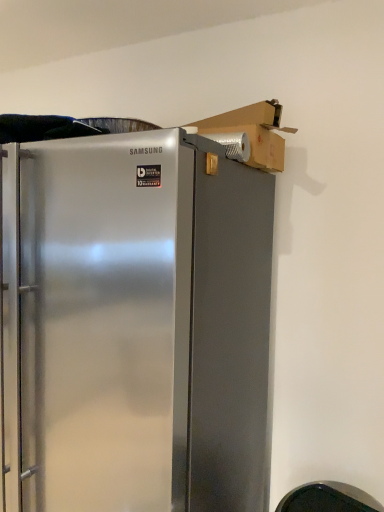
Question: Considering the positions of point (256, 165) and point (218, 385), is point (256, 165) closer or farther from the camera than point (218, 385)?

Choices:
 (A) closer
 (B) farther

Answer: (B)

Question: Considering the positions of cardboard box at upper right and satin metallic refrigerator at center in the image, is cardboard box at upper right taller or shorter than satin metallic refrigerator at center?

Choices:
 (A) short
 (B) tall

Answer: (A)

Question: Is cardboard box at upper right in front of or behind satin metallic refrigerator at center in the image?

Choices:
 (A) behind
 (B) front

Answer: (A)

Question: Is satin metallic refrigerator at center situated inside cardboard box at upper right or outside?

Choices:
 (A) outside
 (B) inside

Answer: (A)

Question: From the image's perspective, is satin metallic refrigerator at center located above or below cardboard box at upper right?

Choices:
 (A) above
 (B) below

Answer: (B)

Question: Considering their positions, is satin metallic refrigerator at center located in front of or behind cardboard box at upper right?

Choices:
 (A) behind
 (B) front

Answer: (B)

Question: Would you say satin metallic refrigerator at center is to the left or to the right of cardboard box at upper right in the picture?

Choices:
 (A) left
 (B) right

Answer: (A)